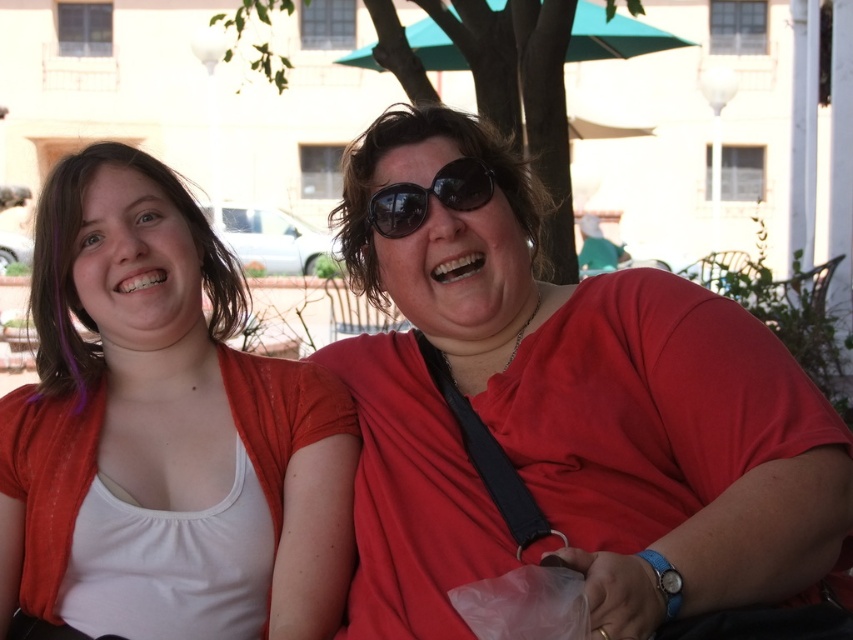
Question: Can you confirm if matte red shirt at center is bigger than white matte tank top at left?

Choices:
 (A) yes
 (B) no

Answer: (A)

Question: Considering the real-world distances, which object is closest to the teal fabric umbrella at upper center?

Choices:
 (A) matte red shirt at center
 (B) black reflective sunglasses at center

Answer: (A)

Question: Which point appears closest to the camera in this image?

Choices:
 (A) (590, 58)
 (B) (370, 346)
 (C) (479, 172)

Answer: (C)

Question: Is the position of matte red shirt at center more distant than that of black reflective sunglasses at center?

Choices:
 (A) no
 (B) yes

Answer: (A)

Question: Can you confirm if matte red shirt at center is thinner than white matte tank top at left?

Choices:
 (A) no
 (B) yes

Answer: (A)

Question: Among these points, which one is farthest from the camera?

Choices:
 (A) (292, 518)
 (B) (596, 29)
 (C) (390, 186)

Answer: (B)